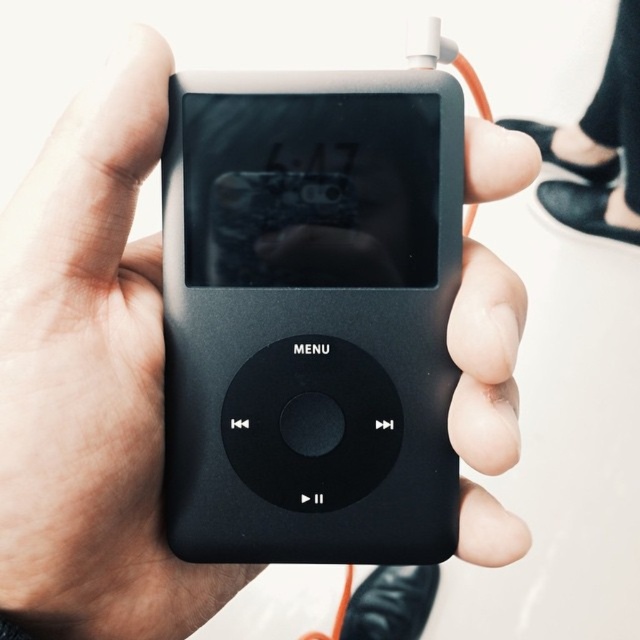
Does black matte/ipod at center appear on the right side of black leather shoe at lower right?

No, black matte/ipod at center is not to the right of black leather shoe at lower right.

Who is more distant from viewer, (282, 344) or (561, 141)?

The point (561, 141) is more distant.

This screenshot has width=640, height=640. I want to click on black matte/ipod at center, so click(x=310, y=316).

This screenshot has height=640, width=640. In order to click on black matte/ipod at center in this screenshot , I will do `click(310, 316)`.